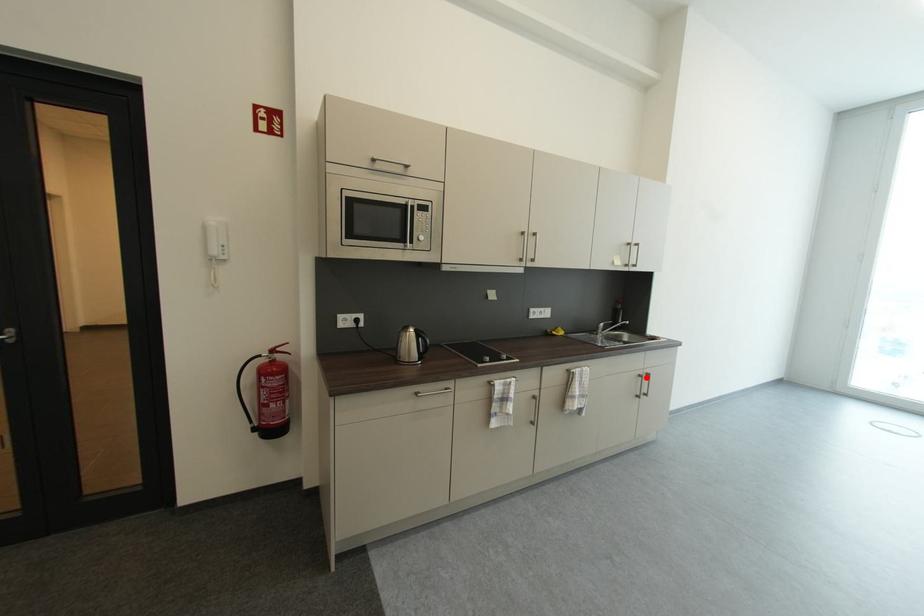
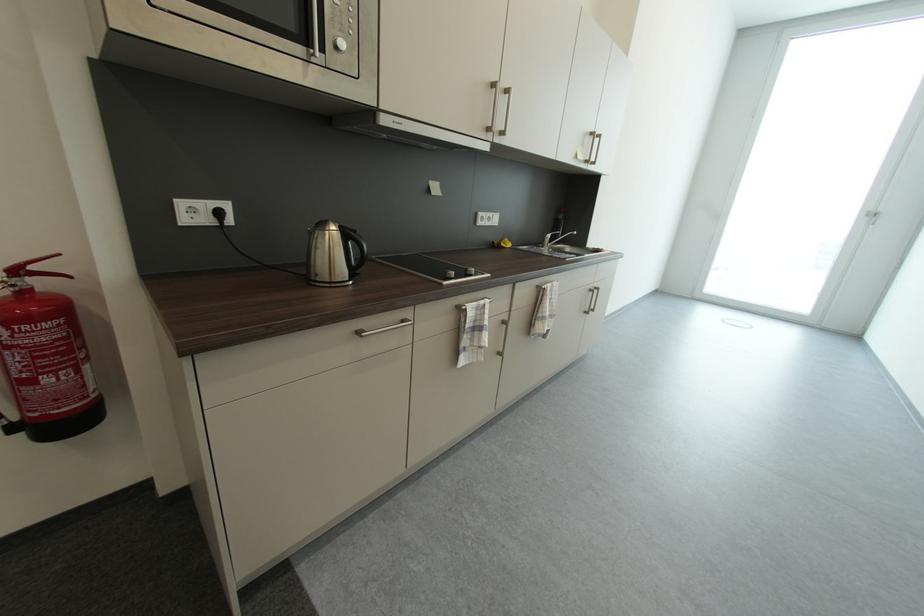
In the second image, find the point that corresponds to the highlighted location in the first image.

(598, 292)